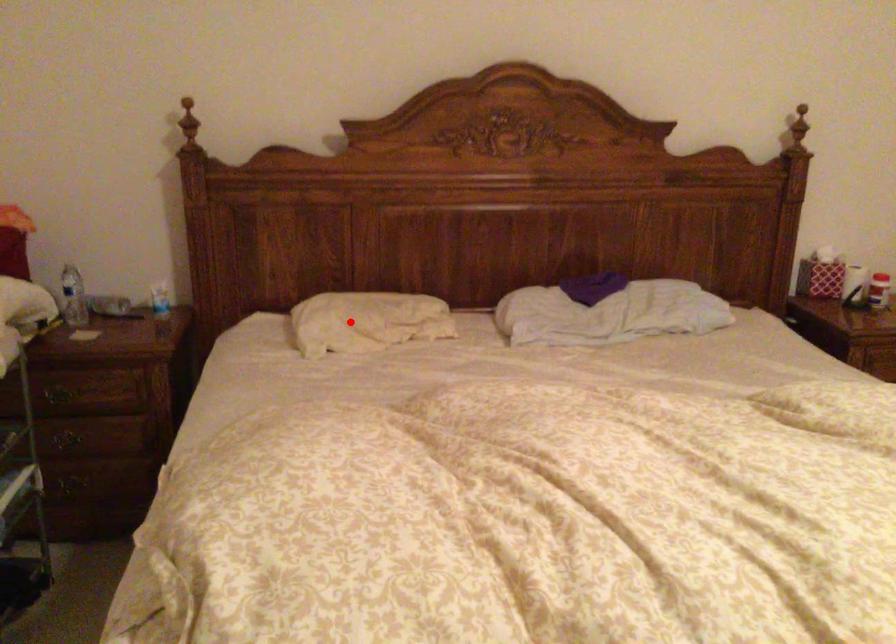
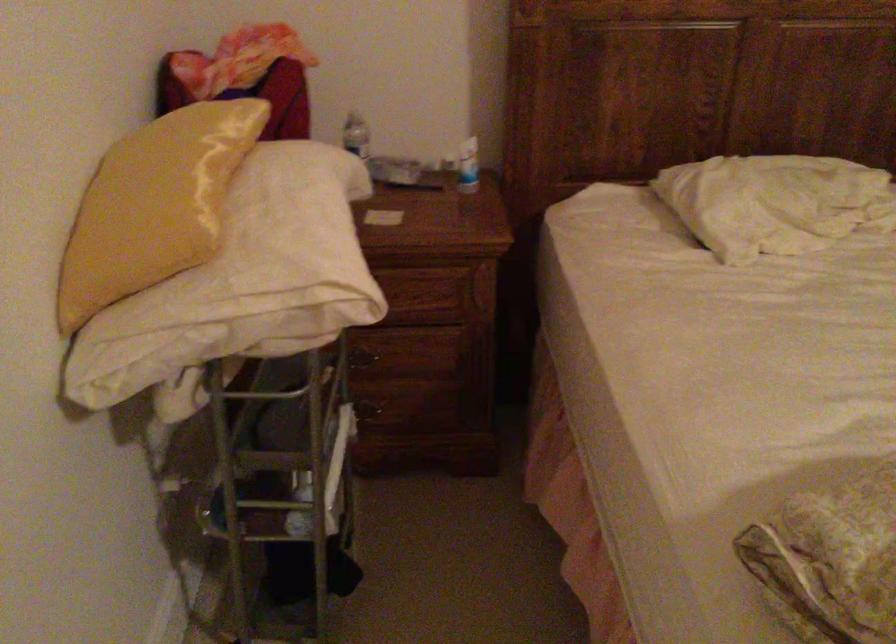
Question: I am providing you with two images of the same scene from different viewpoints. A red point is shown in image1. For the corresponding object point in image2, is it positioned nearer or farther from the camera?

Choices:
 (A) Nearer
 (B) Farther

Answer: (A)